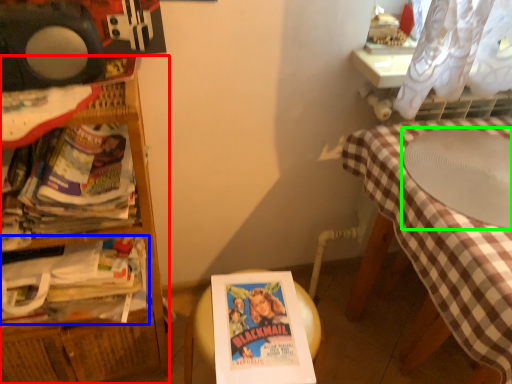
Question: Which is farther away from furniture (highlighted by a red box)? book (highlighted by a blue box) or round table (highlighted by a green box)?

Choices:
 (A) book
 (B) round table

Answer: (B)